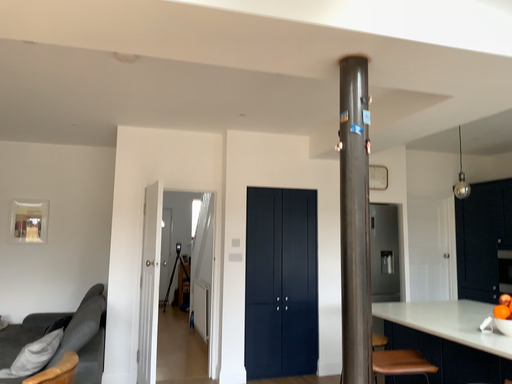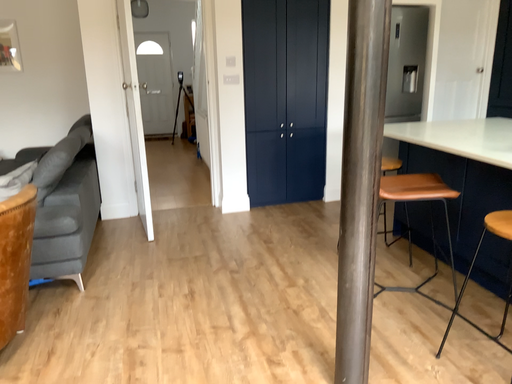
Question: How did the camera likely rotate when shooting the video?

Choices:
 (A) rotated upward
 (B) rotated downward

Answer: (B)